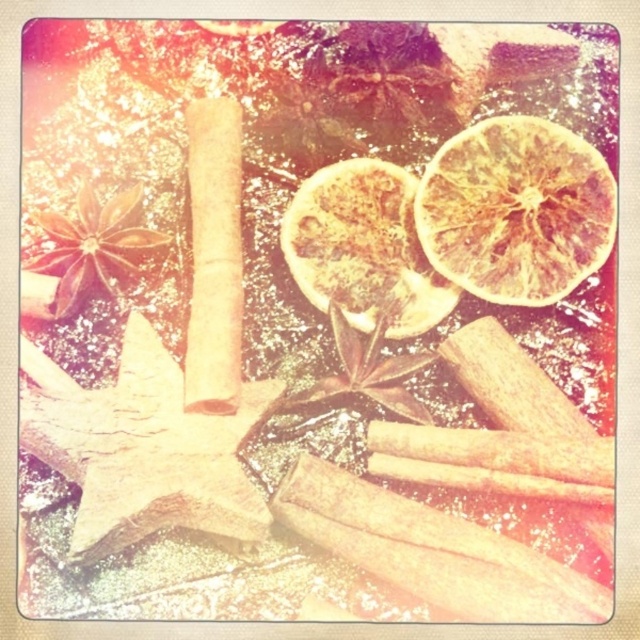
Is dried orange at upper right to the left of dried orange at center from the viewer's perspective?

Incorrect, dried orange at upper right is not on the left side of dried orange at center.

Which is more to the left, dried orange at upper right or dried orange at center?

dried orange at center is more to the left.

Does point (554, 124) come farther from viewer compared to point (381, 205)?

That is False.

The height and width of the screenshot is (640, 640). Identify the location of dried orange at upper right. (516, 211).